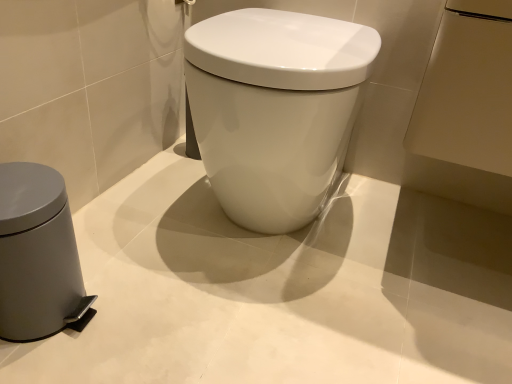
Question: Is gray matte waste container at left looking in the opposite direction of white glossy toilet at center?

Choices:
 (A) yes
 (B) no

Answer: (B)

Question: Is the position of gray matte waste container at left more distant than that of white glossy toilet at center?

Choices:
 (A) yes
 (B) no

Answer: (B)

Question: Is gray matte waste container at left closer to camera compared to white glossy toilet at center?

Choices:
 (A) yes
 (B) no

Answer: (A)

Question: Can you confirm if gray matte waste container at left is positioned to the left of white glossy toilet at center?

Choices:
 (A) no
 (B) yes

Answer: (B)

Question: From the image's perspective, is gray matte waste container at left under white glossy toilet at center?

Choices:
 (A) yes
 (B) no

Answer: (A)

Question: Is white glossy toilet at center in front of or behind metallic silver towel bar at upper center in the image?

Choices:
 (A) behind
 (B) front

Answer: (B)

Question: Considering the positions of white glossy toilet at center and metallic silver towel bar at upper center in the image, is white glossy toilet at center bigger or smaller than metallic silver towel bar at upper center?

Choices:
 (A) big
 (B) small

Answer: (A)

Question: From a real-world perspective, is white glossy toilet at center above or below metallic silver towel bar at upper center?

Choices:
 (A) below
 (B) above

Answer: (A)

Question: In the image, is white glossy toilet at center on the left side or the right side of metallic silver towel bar at upper center?

Choices:
 (A) right
 (B) left

Answer: (A)

Question: Is white glossy toilet at center wider or thinner than gray matte waste container at left?

Choices:
 (A) wide
 (B) thin

Answer: (A)

Question: From the image's perspective, relative to gray matte waste container at left, is white glossy toilet at center above or below?

Choices:
 (A) below
 (B) above

Answer: (B)

Question: From a real-world perspective, is white glossy toilet at center above or below gray matte waste container at left?

Choices:
 (A) below
 (B) above

Answer: (B)

Question: Considering the positions of white glossy toilet at center and gray matte waste container at left in the image, is white glossy toilet at center taller or shorter than gray matte waste container at left?

Choices:
 (A) tall
 (B) short

Answer: (A)

Question: Considering the positions of point (36, 286) and point (220, 190), is point (36, 286) closer or farther from the camera than point (220, 190)?

Choices:
 (A) farther
 (B) closer

Answer: (B)

Question: In terms of size, does gray matte waste container at left appear bigger or smaller than white glossy toilet at center?

Choices:
 (A) small
 (B) big

Answer: (A)